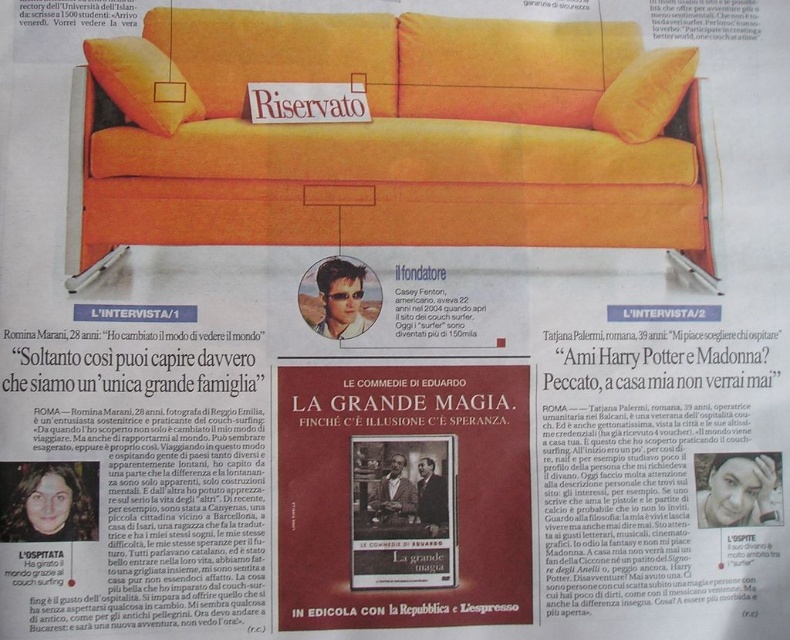
Can you confirm if matte orange pillow at upper left is taller than orange fabric pillow at upper right?

Incorrect, matte orange pillow at upper left's height is not larger of orange fabric pillow at upper right's.

Describe the element at coordinates (141, 83) in the screenshot. I see `matte orange pillow at upper left` at that location.

This screenshot has height=640, width=790. Identify the location of matte orange pillow at upper left. (141, 83).

Find the location of `orange fabric couch at upper center`. orange fabric couch at upper center is located at coordinates (386, 136).

Is orange fabric couch at upper center to the right of matte orange pillow at upper left from the viewer's perspective?

Indeed, orange fabric couch at upper center is positioned on the right side of matte orange pillow at upper left.

Measure the distance between point (269, 218) and camera.

34.70 inches

Find the location of a particular element. Image resolution: width=790 pixels, height=640 pixels. orange fabric couch at upper center is located at coordinates (386, 136).

Can you confirm if orange fabric couch at upper center is bigger than orange fabric pillow at upper right?

Yes, orange fabric couch at upper center is bigger than orange fabric pillow at upper right.

This screenshot has height=640, width=790. Find the location of `orange fabric couch at upper center`. orange fabric couch at upper center is located at coordinates (386, 136).

Is point (269, 65) in front of point (615, 113)?

Yes, it is.

Identify the location of orange fabric couch at upper center. This screenshot has height=640, width=790. (386, 136).